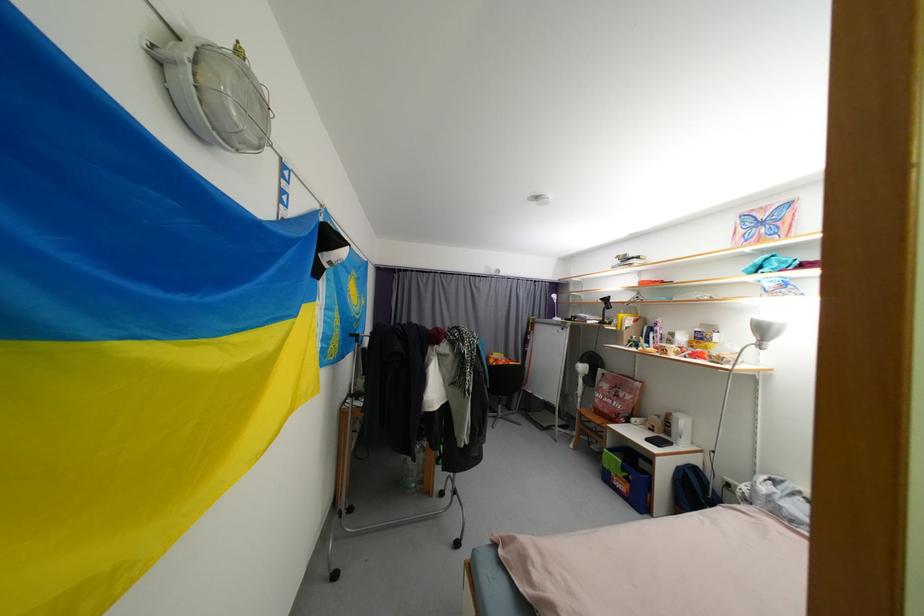
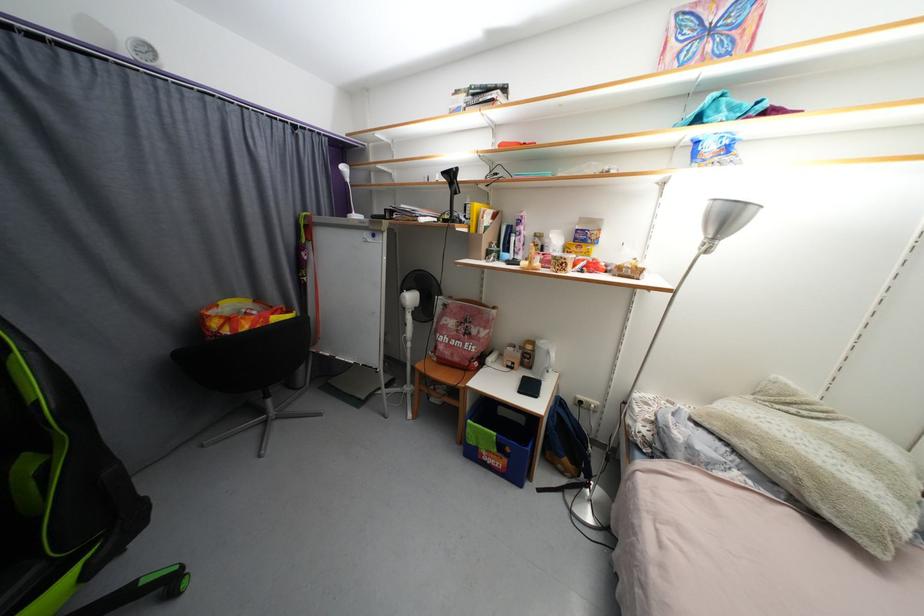
Find the pixel in the second image that matches point 562,321 in the first image.

(360, 217)